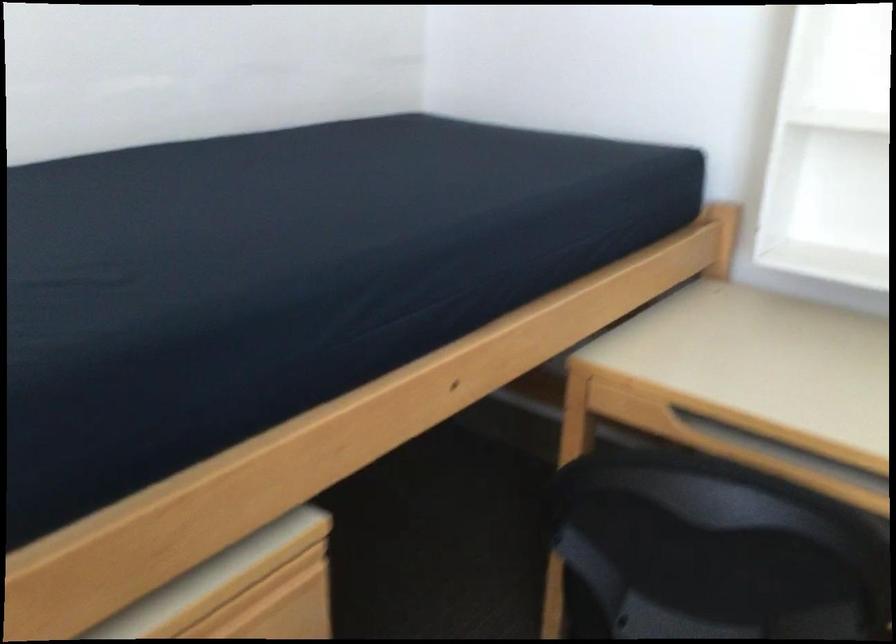
Where would you pull the drawer pull handle? Please return your answer as a coordinate pair (x, y).

(277, 581)